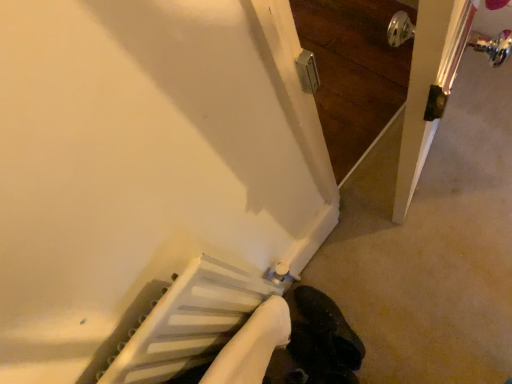
The width and height of the screenshot is (512, 384). I want to click on black suede shoes at lower right, so click(x=329, y=328).

What do you see at coordinates (329, 328) in the screenshot?
I see `black suede shoes at lower right` at bounding box center [329, 328].

Find the location of a particular element. This screenshot has height=384, width=512. black suede shoes at lower right is located at coordinates (329, 328).